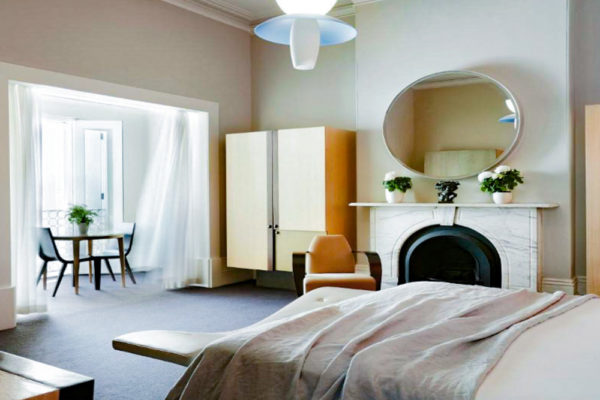
Image resolution: width=600 pixels, height=400 pixels. Find the location of `bedsheet`. bedsheet is located at coordinates (463, 300).